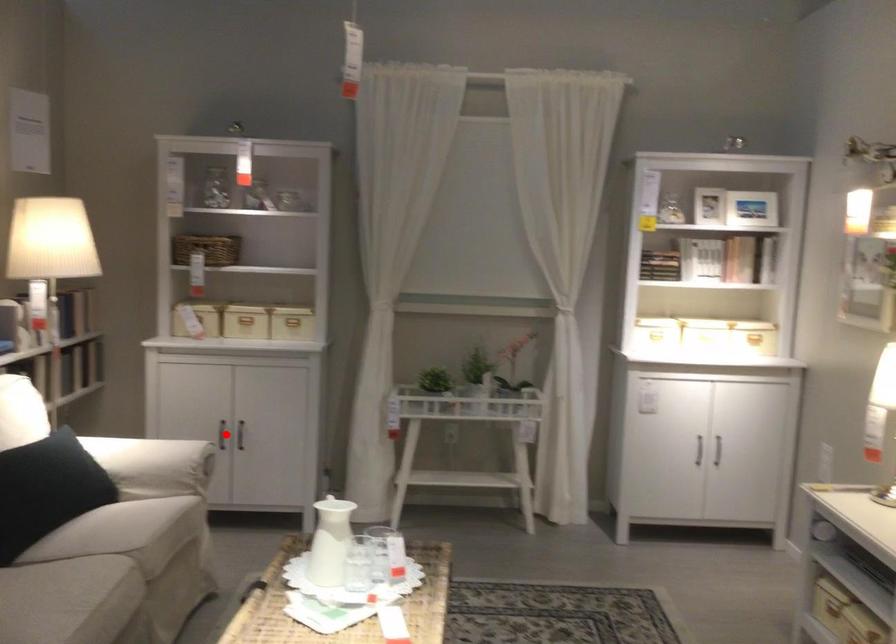
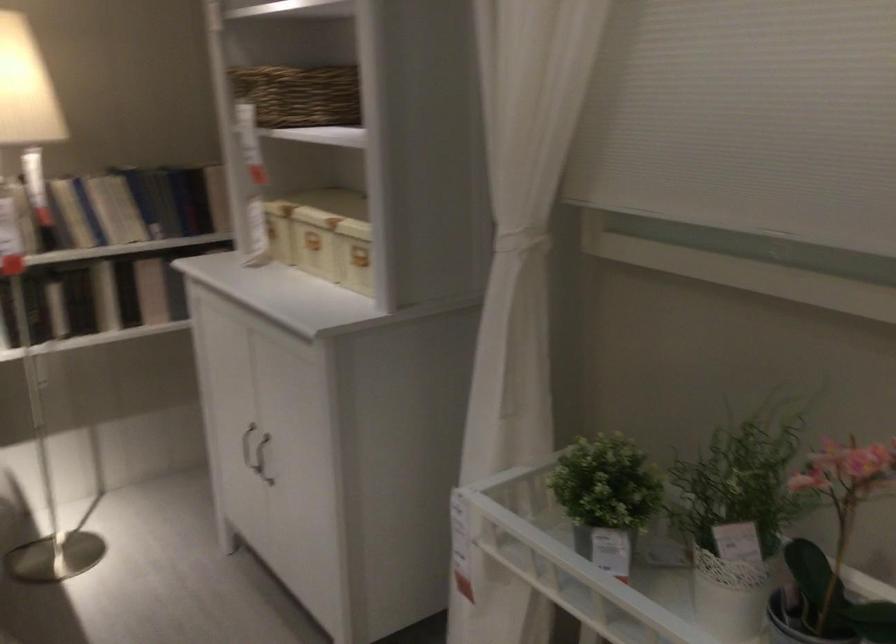
Find the pixel in the second image that matches the highlighted location in the first image.

(247, 446)